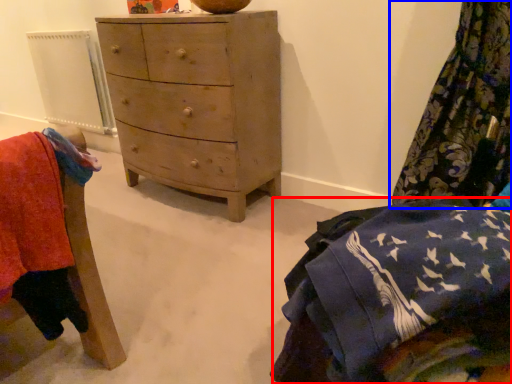
Question: Which object appears farthest to the camera in this image, clothing (highlighted by a red box) or curtain (highlighted by a blue box)?

Choices:
 (A) clothing
 (B) curtain

Answer: (B)